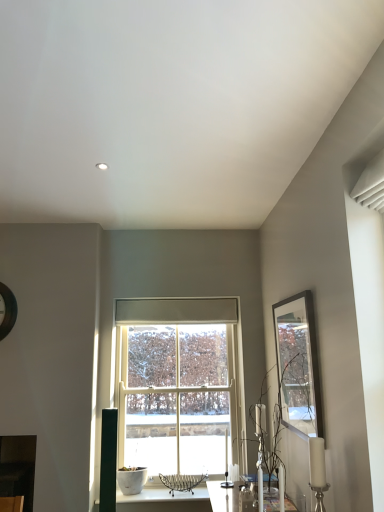
Find the location of a particular element. The image size is (384, 512). white wooden window at center is located at coordinates (177, 383).

In order to click on translucent glass vase at right in this screenshot , I will do `click(273, 445)`.

What do you see at coordinates (273, 445) in the screenshot?
I see `translucent glass vase at right` at bounding box center [273, 445].

You are a GUI agent. You are given a task and a screenshot of the screen. Output one action in this format:
    pyautogui.click(x=<x>, y=<y>)
    Task: Click on the matte black picture frame at upper right
    
    Given the screenshot: What is the action you would take?
    pyautogui.click(x=298, y=365)

Which is nearer, (292, 430) or (264, 450)?

Point (292, 430) is closer to the camera than point (264, 450).

What's the angular difference between matte black picture frame at upper right and translucent glass vase at right's facing directions?

1.46 degrees.

Which is more to the left, matte black picture frame at upper right or translucent glass vase at right?

From the viewer's perspective, translucent glass vase at right appears more on the left side.

At what (x,y) coordinates should I click in order to perform the action: click on plant on the left side of matte black picture frame at upper right. Please return your answer as a coordinate pair (x, y). This screenshot has height=512, width=384. Looking at the image, I should click on coord(273,445).

Considering the sizes of objects white wooden window at center and matte black picture frame at upper right in the image provided, who is bigger, white wooden window at center or matte black picture frame at upper right?

white wooden window at center.

Is matte black picture frame at upper right at the back of white wooden window at center?

No, white wooden window at center's orientation is not away from matte black picture frame at upper right.

From a real-world perspective, is translucent glass vase at right positioned over white wooden window at center based on gravity?

Incorrect, from a real-world perspective, translucent glass vase at right is lower than white wooden window at center.

How far apart are translucent glass vase at right and white wooden window at center?

translucent glass vase at right and white wooden window at center are 29.31 inches apart from each other.

Considering the sizes of objects translucent glass vase at right and white wooden window at center in the image provided, who is thinner, translucent glass vase at right or white wooden window at center?

white wooden window at center.

Is matte black picture frame at upper right at the right side of white wooden window at center?

Yes.

Is matte black picture frame at upper right positioned with its back to white wooden window at center?

No.

From a real-world perspective, who is located lower, matte black picture frame at upper right or white wooden window at center?

white wooden window at center.

Which object is wider, matte black picture frame at upper right or white wooden window at center?

Wider between the two is white wooden window at center.

Where is `plant that is on the left side of matte black picture frame at upper right`? The image size is (384, 512). plant that is on the left side of matte black picture frame at upper right is located at coordinates pos(273,445).

Can matte black picture frame at upper right be found inside translucent glass vase at right?

No, translucent glass vase at right does not contain matte black picture frame at upper right.

Is translucent glass vase at right to the right of matte black picture frame at upper right from the viewer's perspective?

No.

From the image's perspective, between translucent glass vase at right and matte black picture frame at upper right, which one is located above?

From the image's view, matte black picture frame at upper right is above.

Which is behind, point (209, 362) or point (267, 372)?

The point (209, 362) is farther from the camera.

Relative to translucent glass vase at right, is white wooden window at center in front or behind?

In the image, white wooden window at center appears behind translucent glass vase at right.

Find the location of `window above the translucent glass vase at right (from a real-world perspective)`. window above the translucent glass vase at right (from a real-world perspective) is located at coordinates (177, 383).

Would you consider white wooden window at center to be distant from translucent glass vase at right?

white wooden window at center is near translucent glass vase at right, not far away.

At what (x,y) coordinates should I click in order to perform the action: click on picture frame in front of the translucent glass vase at right. Please return your answer as a coordinate pair (x, y). The height and width of the screenshot is (512, 384). Looking at the image, I should click on (x=298, y=365).

Identify the location of window below the matte black picture frame at upper right (from a real-world perspective). The image size is (384, 512). [177, 383].

Which object lies nearer to the anchor point matte black picture frame at upper right, translucent glass vase at right or white wooden window at center?

Based on the image, translucent glass vase at right appears to be nearer to matte black picture frame at upper right.

In the scene shown: Considering their positions, is matte black picture frame at upper right positioned further to translucent glass vase at right than white wooden window at center?

The object further to translucent glass vase at right is white wooden window at center.

Looking at the image, which one is located closer to white wooden window at center, translucent glass vase at right or matte black picture frame at upper right?

translucent glass vase at right.

Which object lies nearer to the anchor point white wooden window at center, matte black picture frame at upper right or translucent glass vase at right?

translucent glass vase at right lies closer to white wooden window at center than the other object.

From the image, which object appears to be farther from translucent glass vase at right, white wooden window at center or matte black picture frame at upper right?

Among the two, white wooden window at center is located further to translucent glass vase at right.

Which object lies further to the anchor point matte black picture frame at upper right, white wooden window at center or translucent glass vase at right?

Based on the image, white wooden window at center appears to be further to matte black picture frame at upper right.

At what (x,y) coordinates should I click in order to perform the action: click on plant between matte black picture frame at upper right and white wooden window at center from front to back. Please return your answer as a coordinate pair (x, y). This screenshot has width=384, height=512. Looking at the image, I should click on (273, 445).